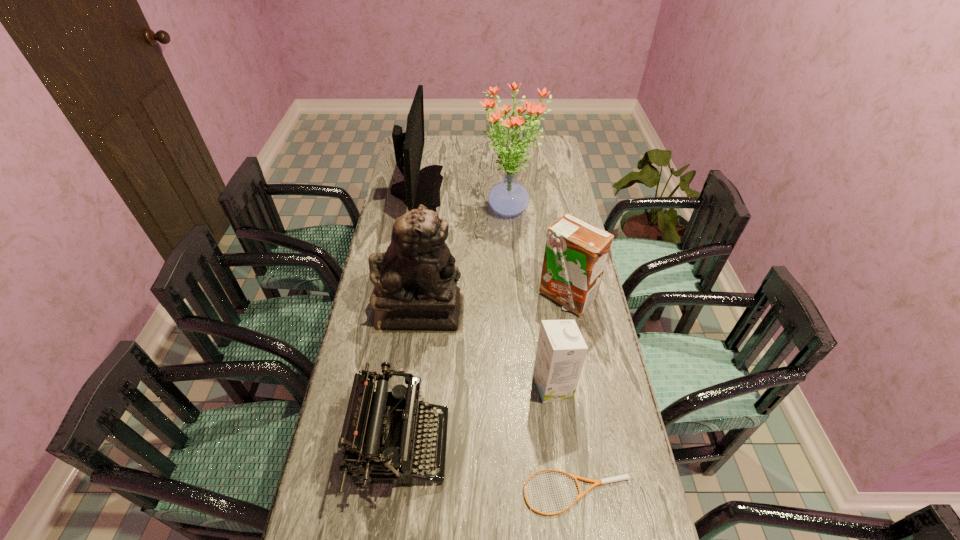
This screenshot has height=540, width=960. I want to click on the closest object relative to the typewriter, so (x=621, y=477).

I want to click on object identified as the fourth closest to the nearer carton, so pos(415,281).

Where is `free space that satisfies the following two spatial constraints: 1. on the straw side of the farther carton; 2. on the keyboard of the typewriter`? free space that satisfies the following two spatial constraints: 1. on the straw side of the farther carton; 2. on the keyboard of the typewriter is located at coordinates (593, 446).

Locate an element on the screen. This screenshot has width=960, height=540. vacant region that satisfies the following two spatial constraints: 1. on the screen side of the monitor; 2. on the left side of the nearer carton is located at coordinates (383, 386).

You are a GUI agent. You are given a task and a screenshot of the screen. Output one action in this format:
    pyautogui.click(x=<x>, y=<y>)
    Task: Click on the vacant space that satisfies the following two spatial constraints: 1. on the front-facing side of the sculpture; 2. on the back side of the nearer carton
    The image size is (960, 540).
    Given the screenshot: What is the action you would take?
    [x=411, y=386]